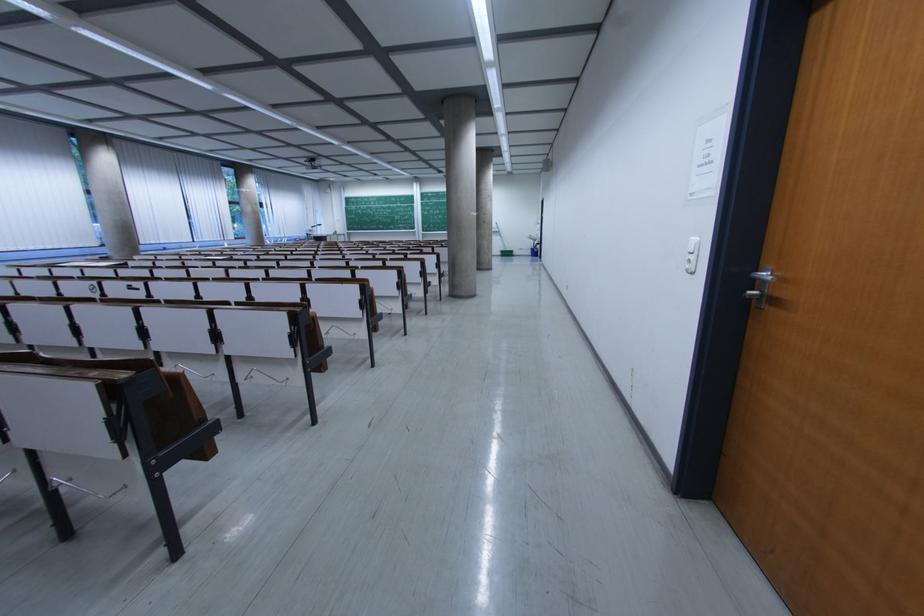
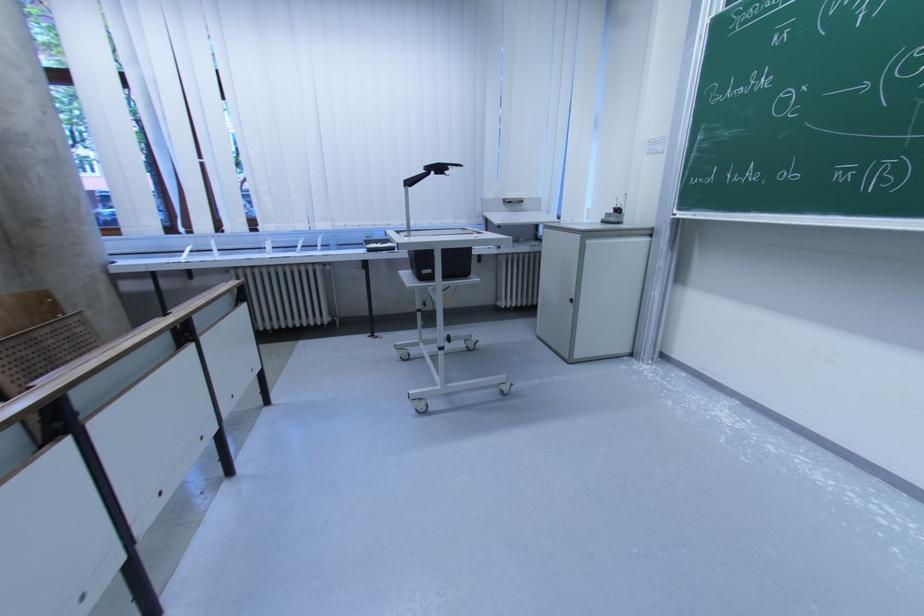
Where in the second image is the point corresponding to (323,227) from the first image?

(444, 171)